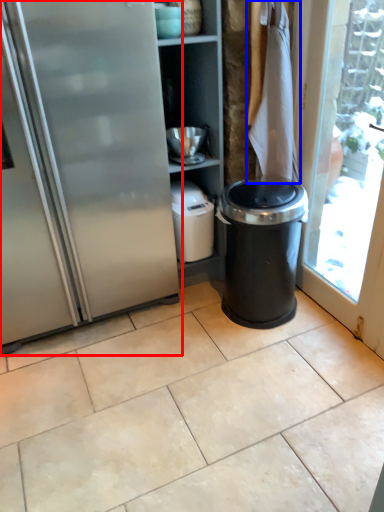
Question: Which point is closer to the camera, fridge (highlighted by a red box) or laundry (highlighted by a blue box)?

Choices:
 (A) fridge
 (B) laundry

Answer: (A)